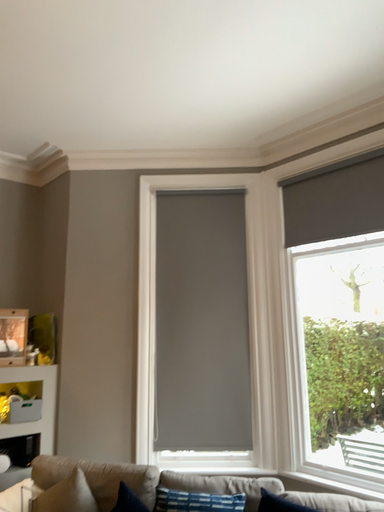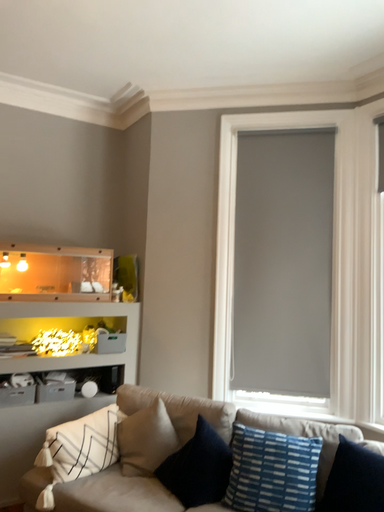
Question: How did the camera likely rotate when shooting the video?

Choices:
 (A) rotated upward
 (B) rotated downward

Answer: (B)